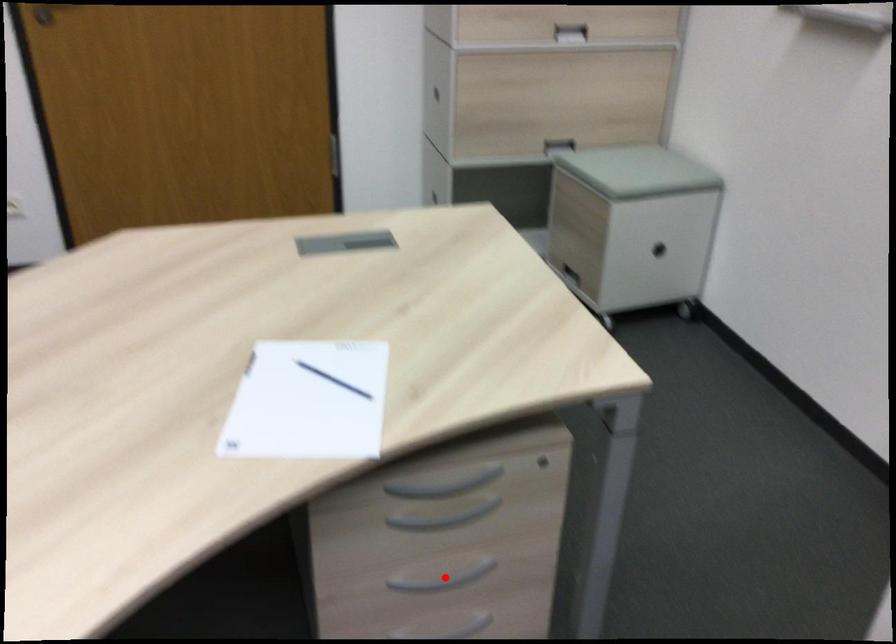
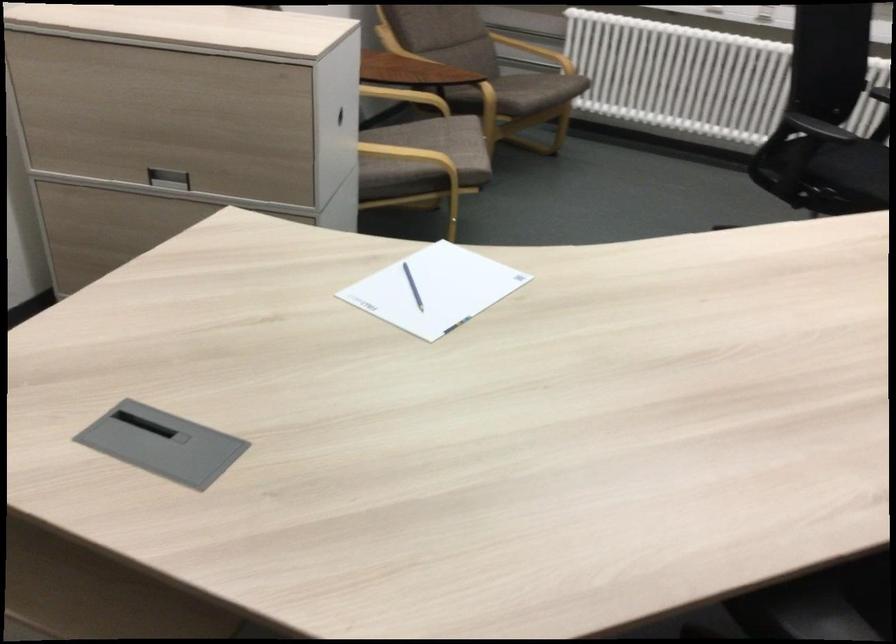
Question: I am providing you with two images of the same scene from different viewpoints. A red point is marked on the first image. At the location where the point appears in image 1, is it still visible in image 2?

Choices:
 (A) Yes
 (B) No

Answer: (B)